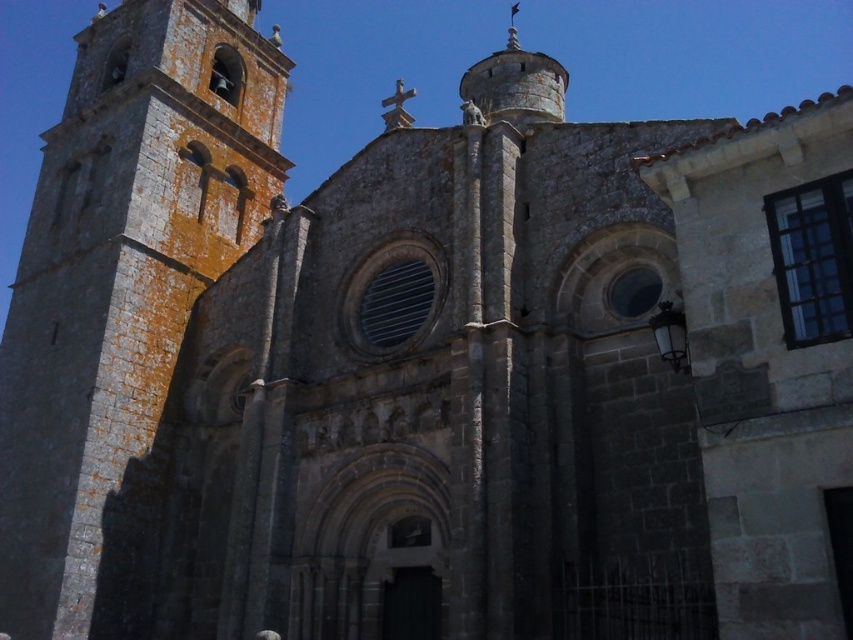
Does greenish stone tower at left appear over smooth stone spire at upper center?

No.

Where is `greenish stone tower at left`? greenish stone tower at left is located at coordinates (120, 275).